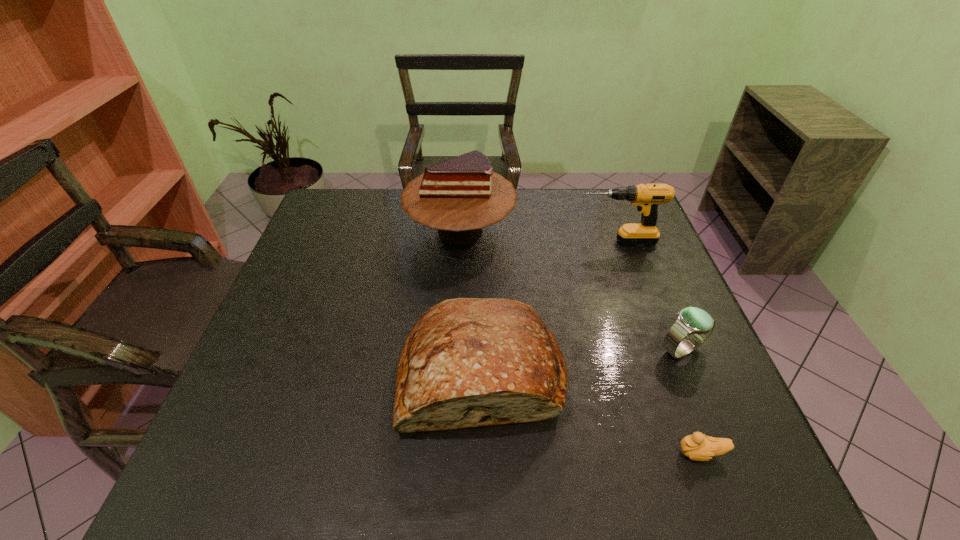
The width and height of the screenshot is (960, 540). What are the coordinates of `empty space that is in between the watch and the cake` in the screenshot? It's located at pyautogui.click(x=571, y=291).

I want to click on free area in between the drill and the watch, so click(x=649, y=296).

I want to click on free area in between the shortest object and the drill, so click(x=659, y=348).

At what (x,y) coordinates should I click in order to perform the action: click on vacant space in between the bread and the nearest object. Please return your answer as a coordinate pair (x, y). Looking at the image, I should click on (591, 413).

Identify the location of the fourth closest object to the bread. (647, 197).

You are a GUI agent. You are given a task and a screenshot of the screen. Output one action in this format:
    pyautogui.click(x=<x>, y=<y>)
    Task: Click on the object that can be found as the closest to the watch
    
    Given the screenshot: What is the action you would take?
    pyautogui.click(x=697, y=447)

Locate an element on the screen. The image size is (960, 540). vacant region that satisfies the following two spatial constraints: 1. at the tip of the drill; 2. on the left side of the fourth tallest object is located at coordinates (656, 350).

Where is `vacant space that satisfies the following two spatial constraints: 1. on the front side of the second shortest object; 2. on the face of the duckling`? vacant space that satisfies the following two spatial constraints: 1. on the front side of the second shortest object; 2. on the face of the duckling is located at coordinates (724, 454).